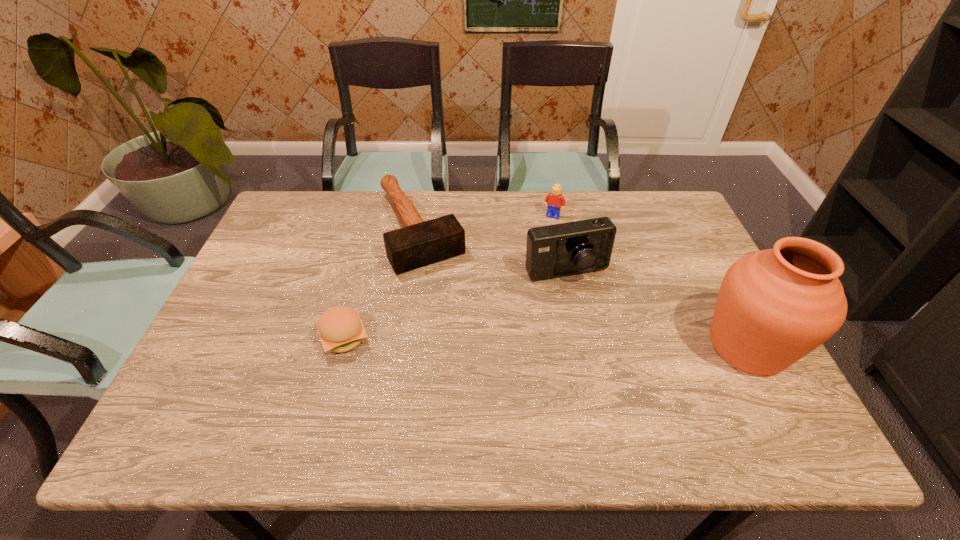
Where is `vacant spot on the desktop that is between the hamburger and the urn and is positioned on the striking face of the mallet`? Image resolution: width=960 pixels, height=540 pixels. vacant spot on the desktop that is between the hamburger and the urn and is positioned on the striking face of the mallet is located at coordinates (489, 341).

Where is `vacant spot on the desktop that is between the hamburger and the urn and is positioned on the front-facing side of the camera`? This screenshot has height=540, width=960. vacant spot on the desktop that is between the hamburger and the urn and is positioned on the front-facing side of the camera is located at coordinates 599,343.

I want to click on vacant space on the desktop that is between the hamburger and the urn and is positioned on the front-facing side of the third shortest object, so click(x=492, y=341).